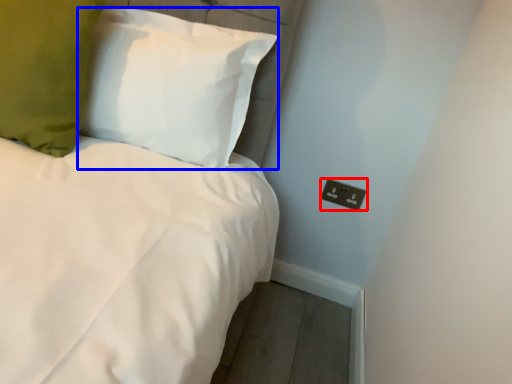
Question: Which point is further to the camera, electric outlet (highlighted by a red box) or pillow (highlighted by a blue box)?

Choices:
 (A) electric outlet
 (B) pillow

Answer: (A)